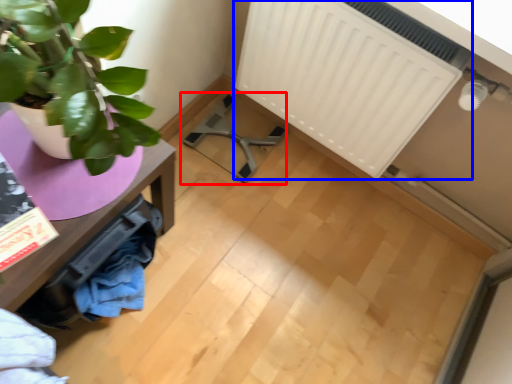
Question: Which of the following is the farthest to the observer, swivel chair (highlighted by a red box) or radiator (highlighted by a blue box)?

Choices:
 (A) swivel chair
 (B) radiator

Answer: (A)